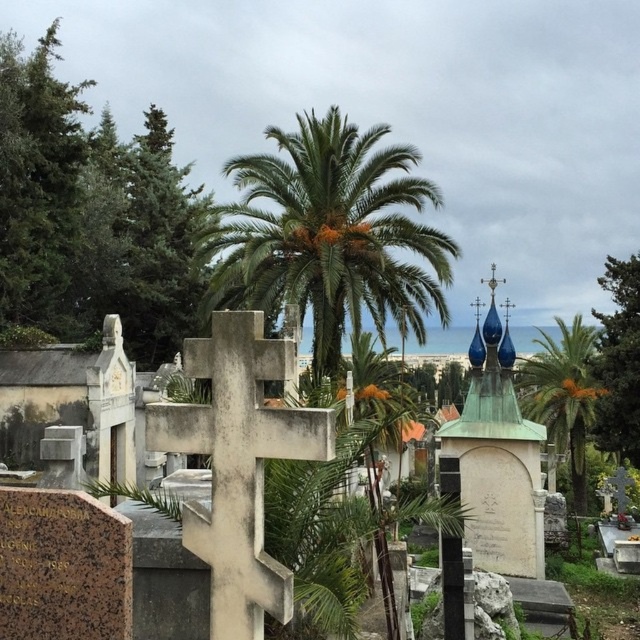
Which is more to the right, white stone cross at center or green leafy tree at upper right?

Positioned to the right is green leafy tree at upper right.

Can you confirm if white stone cross at center is positioned to the left of green leafy tree at upper right?

Yes, white stone cross at center is to the left of green leafy tree at upper right.

Locate an element on the screen. white stone cross at center is located at coordinates (236, 468).

Is white stone cross at center wider than green leafy palm tree at center?

Incorrect, white stone cross at center's width does not surpass green leafy palm tree at center's.

Which is more to the left, white stone cross at center or green leafy palm tree at center?

Positioned to the left is white stone cross at center.

Which is behind, point (180, 442) or point (548, 340)?

Point (548, 340)

This screenshot has height=640, width=640. Identify the location of white stone cross at center. (236, 468).

Who is shorter, green leafy tree at left or metallic cross at upper center?

metallic cross at upper center is shorter.

Which is in front, point (125, 163) or point (481, 280)?

Positioned in front is point (481, 280).

In order to click on green leafy tree at left in this screenshot , I will do `click(92, 214)`.

This screenshot has height=640, width=640. I want to click on green leafy tree at left, so click(x=92, y=214).